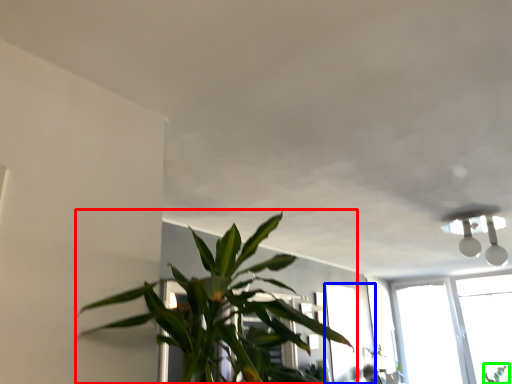
Question: Based on their relative distances, which object is nearer to houseplant (highlighted by a red box)? Choose from window (highlighted by a blue box) and plant (highlighted by a green box).

Choices:
 (A) window
 (B) plant

Answer: (A)